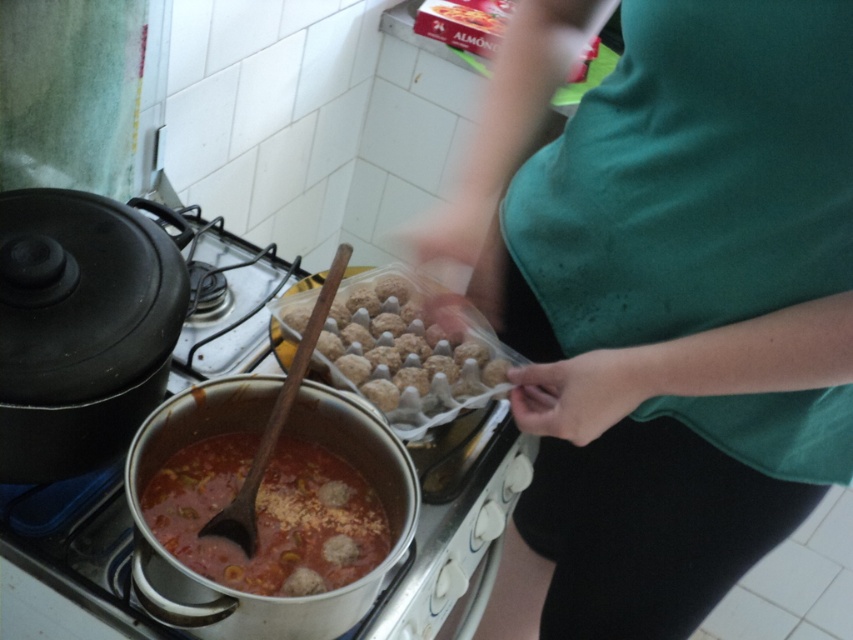
Does point (821, 243) come behind point (381, 404)?

No, it is in front of (381, 404).

Find the location of `green fabric shirt at upper center`. green fabric shirt at upper center is located at coordinates (665, 300).

Is point (798, 35) behind point (347, 298)?

That is False.

Locate an element on the screen. green fabric shirt at upper center is located at coordinates (665, 300).

Who is lower down, green fabric shirt at upper center or tomato-based meatballs at center?

Positioned lower is tomato-based meatballs at center.

Does green fabric shirt at upper center have a smaller size compared to tomato-based meatballs at center?

Incorrect, green fabric shirt at upper center is not smaller in size than tomato-based meatballs at center.

Who is more distant from viewer, (523,52) or (344,548)?

Point (523,52)

Where is `green fabric shirt at upper center`? This screenshot has width=853, height=640. green fabric shirt at upper center is located at coordinates (665, 300).

Which is below, stainless steel stove at center or brown matte meatballs at center?

stainless steel stove at center is below.

In the scene shown: Does stainless steel stove at center appear on the left side of brown matte meatballs at center?

Correct, you'll find stainless steel stove at center to the left of brown matte meatballs at center.

Where is `stainless steel stove at center`? stainless steel stove at center is located at coordinates (73, 560).